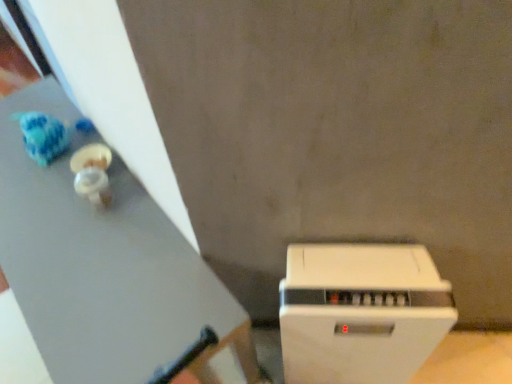
The image size is (512, 384). What are the coordinates of `vacant space situated above white matte table at upper left (from a real-world perspective)` in the screenshot? It's located at pos(76,231).